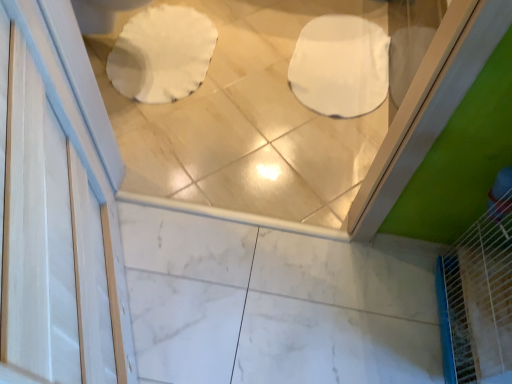
What do you see at coordinates (162, 54) in the screenshot? The height and width of the screenshot is (384, 512). I see `white paper toilet at upper left` at bounding box center [162, 54].

This screenshot has height=384, width=512. What are the coordinates of `white paper toilet at upper left` in the screenshot? It's located at (162, 54).

Locate an element on the screen. Image resolution: width=512 pixels, height=384 pixels. white paper toilet at upper left is located at coordinates (162, 54).